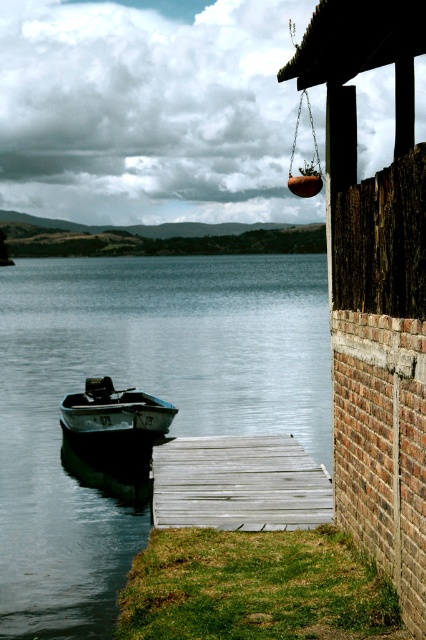
Question: Can you confirm if smooth blue water at lower left is bigger than rustic wooden hut at right?

Choices:
 (A) no
 (B) yes

Answer: (B)

Question: Which of these objects is positioned farthest from the green weathered metal boat at left?

Choices:
 (A) weathered wood dock at lower center
 (B) smooth blue water at lower left
 (C) rustic wooden hut at right

Answer: (B)

Question: Which of the following is the farthest from the observer?

Choices:
 (A) weathered wood dock at lower center
 (B) rustic wooden hut at right
 (C) green weathered metal boat at left
 (D) smooth blue water at lower left

Answer: (C)

Question: Is smooth blue water at lower left positioned at the back of green weathered metal boat at left?

Choices:
 (A) yes
 (B) no

Answer: (B)

Question: Does rustic wooden hut at right have a larger size compared to green weathered metal boat at left?

Choices:
 (A) no
 (B) yes

Answer: (B)

Question: Which point appears farthest from the camera in this image?

Choices:
 (A) (161, 412)
 (B) (379, 184)
 (C) (284, 426)

Answer: (C)